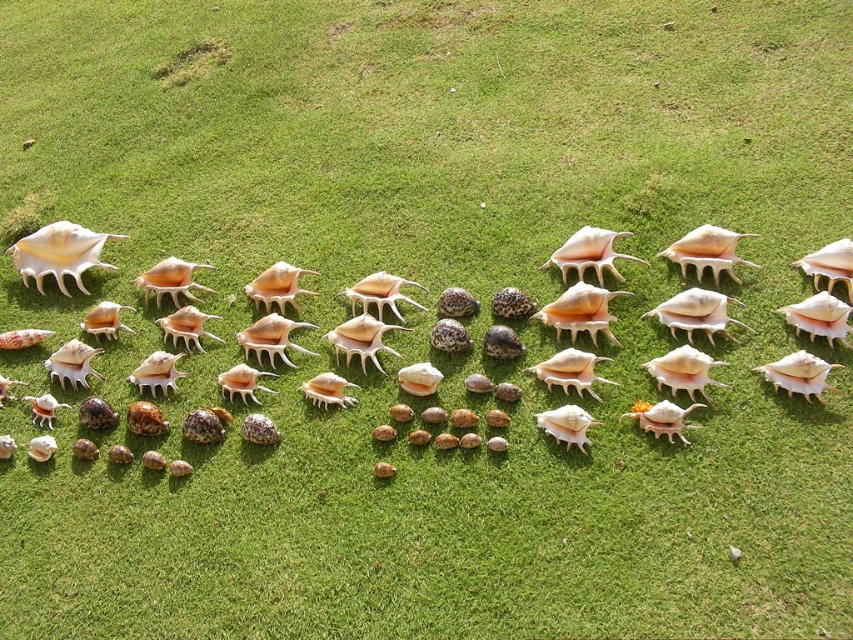
Question: Can you confirm if translucent white seashell at center is thinner than matte white shell at upper left?

Choices:
 (A) yes
 (B) no

Answer: (B)

Question: Among these objects, which one is farthest from the camera?

Choices:
 (A) translucent white seashell at center
 (B) matte white shell at upper left
 (C) shiny beige seashell at center

Answer: (B)

Question: Is matte white shell at upper left thinner than shiny beige seashell at center?

Choices:
 (A) no
 (B) yes

Answer: (A)

Question: Which point appears farthest from the camera in this image?

Choices:
 (A) (723, 296)
 (B) (584, 248)

Answer: (B)

Question: Can you confirm if translucent white seashell at center is positioned to the left of shiny beige seashell at center?

Choices:
 (A) no
 (B) yes

Answer: (B)

Question: Which is farther from the matte white shell at upper left?

Choices:
 (A) shiny beige seashell at center
 (B) translucent white seashell at center

Answer: (A)